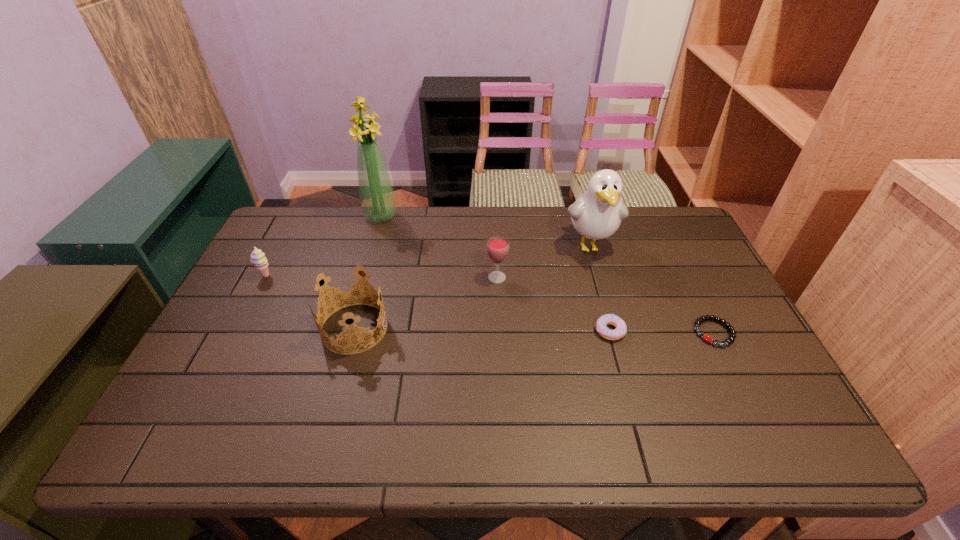
Identify the location of the tallest object. Image resolution: width=960 pixels, height=540 pixels. (376, 193).

This screenshot has height=540, width=960. In order to click on gull in this screenshot , I will do `click(597, 214)`.

You are a GUI agent. You are given a task and a screenshot of the screen. Output one action in this format:
    pyautogui.click(x=<x>, y=<y>)
    Task: Click on the crown
    The width and height of the screenshot is (960, 540).
    Given the screenshot: What is the action you would take?
    pyautogui.click(x=353, y=332)

Where is `the fourth object from right to left`? The image size is (960, 540). the fourth object from right to left is located at coordinates (497, 246).

At what (x,y) coordinates should I click in order to perform the action: click on the third shortest object. Please return your answer as a coordinate pair (x, y). Looking at the image, I should click on pyautogui.click(x=258, y=258).

Where is `the leftmost object`? the leftmost object is located at coordinates (258, 258).

Find the location of `doughnut`. doughnut is located at coordinates (608, 319).

The height and width of the screenshot is (540, 960). What are the coordinates of `the rightmost object` in the screenshot? It's located at (732, 336).

Locate an element on the screen. The height and width of the screenshot is (540, 960). the shortest object is located at coordinates (732, 336).

This screenshot has height=540, width=960. In order to click on vacant space located on the front-facing side of the bouquet in this screenshot , I will do `click(370, 256)`.